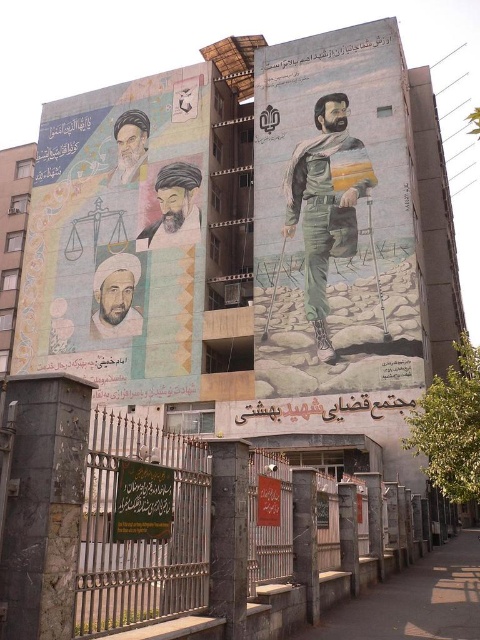
From the picture: You are standing at a point 195.13 feet away from the mural. If you want to take a photo of the point marked at coordinates (312, 285) on the mural, which part of the mural should you focus your camera on?

The point marked at coordinates (312, 285) is 195.13 feet away from the camera. Therefore, you should focus your camera on the central figure of a man in military attire holding crutches on the rocky terrain, as that is the location corresponding to the coordinates provided.